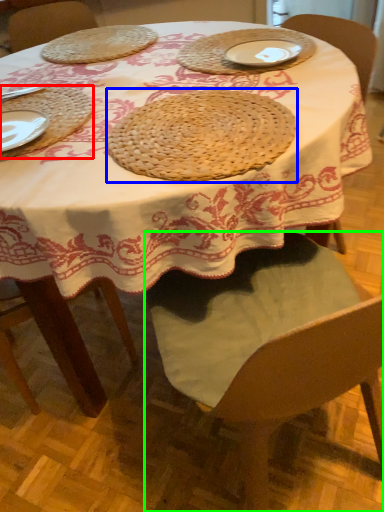
Question: Considering the real-world distances, which object is closest to tray (highlighted by a red box)? pie (highlighted by a blue box) or chair (highlighted by a green box).

Choices:
 (A) pie
 (B) chair

Answer: (A)